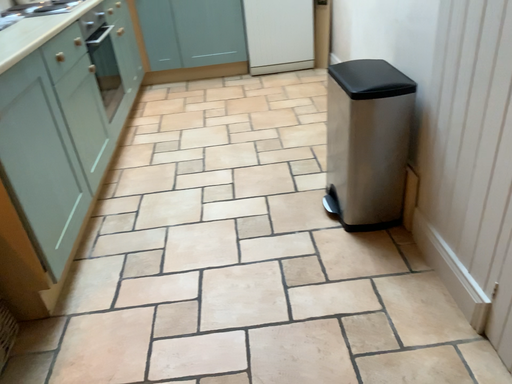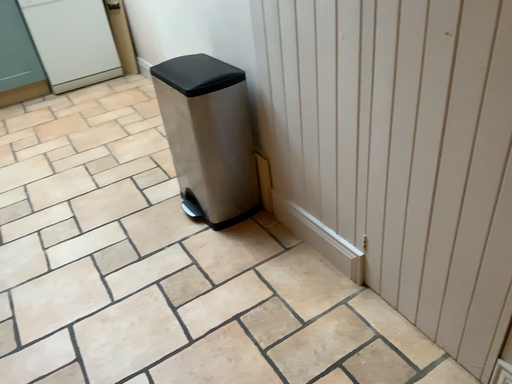
Question: Which way did the camera rotate in the video?

Choices:
 (A) rotated left
 (B) rotated right

Answer: (B)